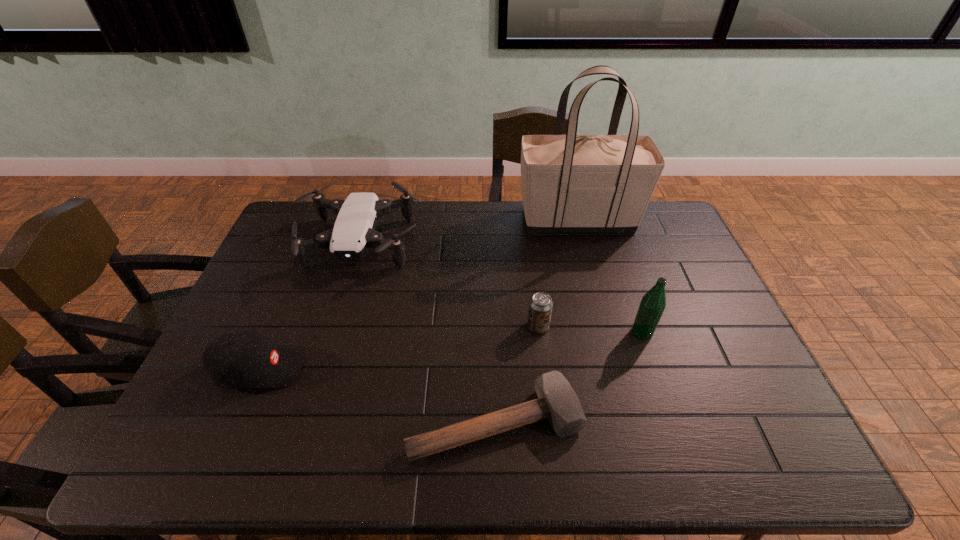
Where is `vacant position located on the camera side of the drone`? vacant position located on the camera side of the drone is located at coordinates [x=315, y=393].

Identify the location of vacant space located on the left of the beer can. The height and width of the screenshot is (540, 960). (449, 327).

I want to click on free spot located with a logo on the front of the baseball cap, so click(x=341, y=369).

Identify the location of vacant region located on the left of the shortest object. (346, 423).

Find the location of a particular element. This screenshot has width=960, height=540. shopping bag that is at the far edge is located at coordinates (571, 183).

Locate an element on the screen. drone that is at the far edge is located at coordinates (354, 232).

Find the location of a particular element. object that is at the near edge is located at coordinates (557, 401).

I want to click on drone situated at the left edge, so click(x=354, y=232).

Where is `baseball cap that is at the left edge`? baseball cap that is at the left edge is located at coordinates (245, 358).

You are a GUI agent. You are given a task and a screenshot of the screen. Output one action in this format:
    pyautogui.click(x=<x>, y=<y>)
    Task: Click on the object at the right edge
    
    Given the screenshot: What is the action you would take?
    pyautogui.click(x=571, y=183)